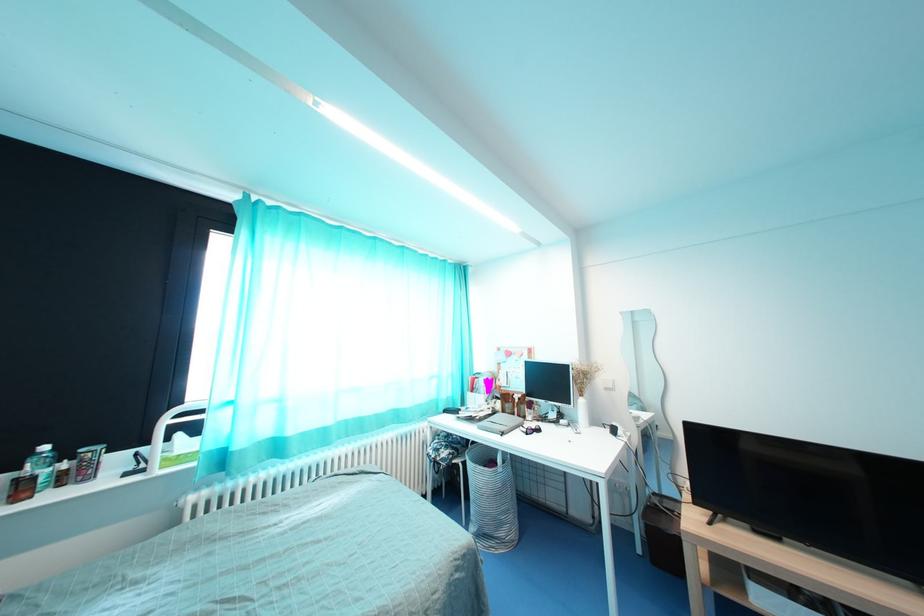
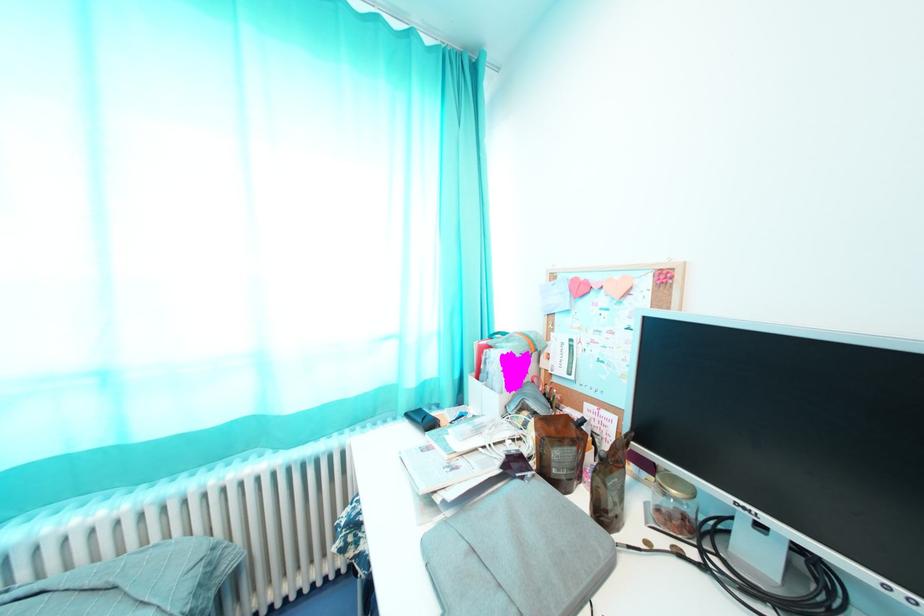
Question: What movement of the cameraman would produce the second image?

Choices:
 (A) Left
 (B) Right
 (C) Forward
 (D) Backward

Answer: (C)